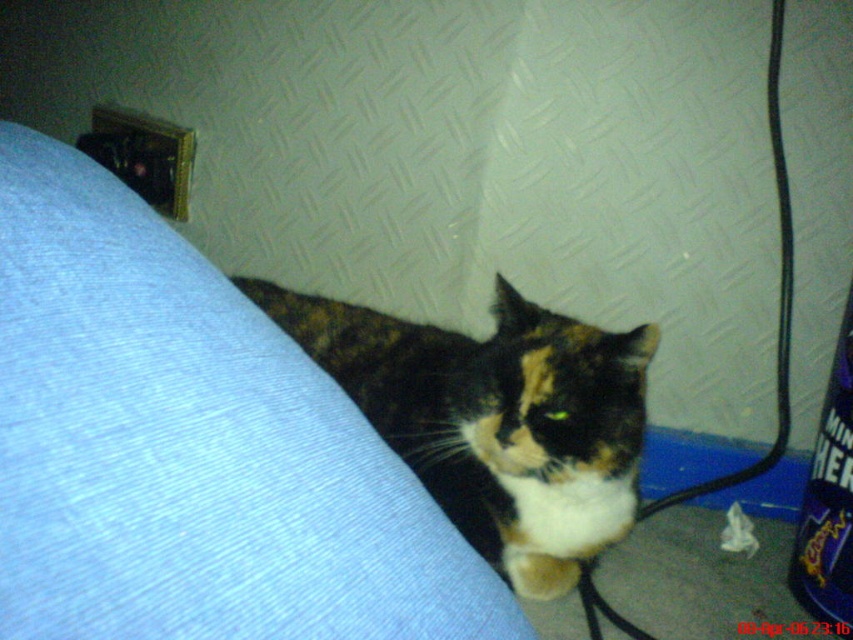
You are an interior designer planning to place a new lamp on the blue fabric couch at lower left. Based on the coordinates provided, where exactly should the lamp be placed?

The blue fabric couch at lower left is located at coordinates point (190, 449). The lamp should be placed there.

You are a robotic vacuum that is 12 inches in diameter. You are in the living room and need to move from the blue fabric couch at lower left to the calico fur cat at center. Can you fit through the space between them?

The blue fabric couch at lower left and calico fur cat at center are 20.36 inches apart from each other. Since the robotic vacuum is 12 inches in diameter, it can fit through the space between them as the distance is greater than the vacuum cleaner.

You are a photographer trying to capture the calico fur cat at center on the blue fabric couch at lower left. To ensure the cat stays on the couch, where should you position yourself relative to the cat?

You should position yourself to the right of the calico fur cat at center since the blue fabric couch at lower left is to the left of the cat, so standing on the opposite side would help keep the cat on the couch.